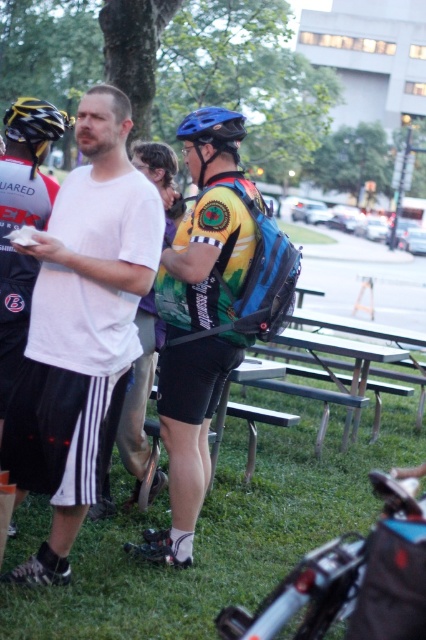
You are planning to place a new red bicycle helmet in the image so that it is between the yellow matte bicycle helmet at upper left and the blue matte bicycle helmet at center. Is this possible?

The yellow matte bicycle helmet at upper left is located above the blue matte bicycle helmet at center. Therefore, placing a red bicycle helmet between them would require positioning it in the space between their vertical positions, which is feasible as long as there is enough vertical space between them.

You are organizing a cycling event and need to ensure helmets fit properly. You have two helmets available for participants to try on. The yellow matte bicycle helmet at upper left and the blue matte bicycle helmet at center. Which helmet should a participant with a head circumference of 58 cm choose?

The yellow matte bicycle helmet at upper left is wider than the blue matte bicycle helmet at center, so the participant should choose the yellow matte bicycle helmet at upper left as it may better accommodate their head circumference of 58 cm.